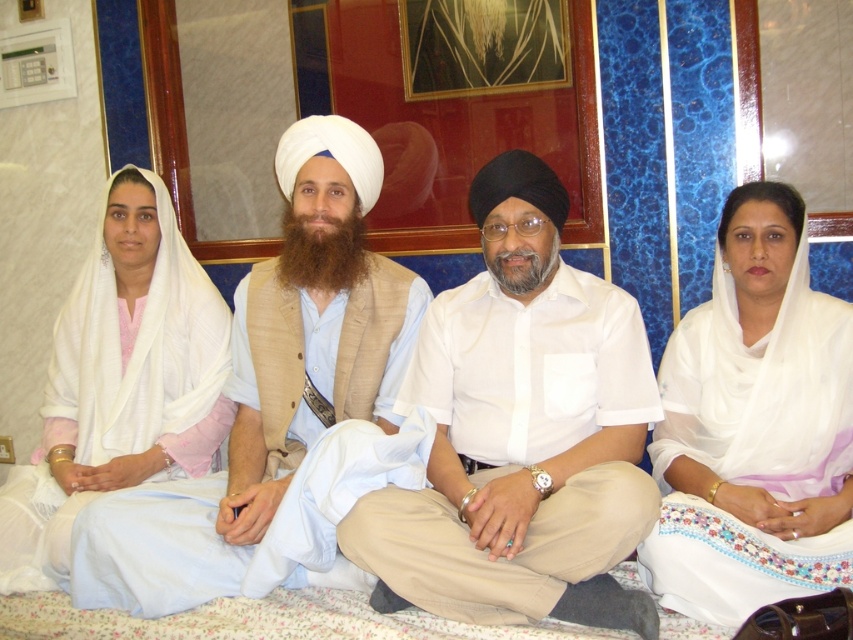
You are organizing a photo shoot and need to ensure that the white cotton shirt at center and the white cotton robe at center are visible in the frame. Given that the camera has a limited field of view, which clothing item might require adjustment to ensure it fits within the frame?

The white cotton robe at center has a greater width than the white cotton shirt at center, so it might require adjustment to ensure it fits within the camera frame.

You are a photographer adjusting your camera to capture the scene. You notice the white sheer scarf at right and the white cotton robe at center. Which object should you focus on first if you want to ensure both are in sharp focus, considering their positions?

The white sheer scarf at right is in front of the white cotton robe at center, so you should focus on the white sheer scarf at right first to ensure both are in sharp focus.